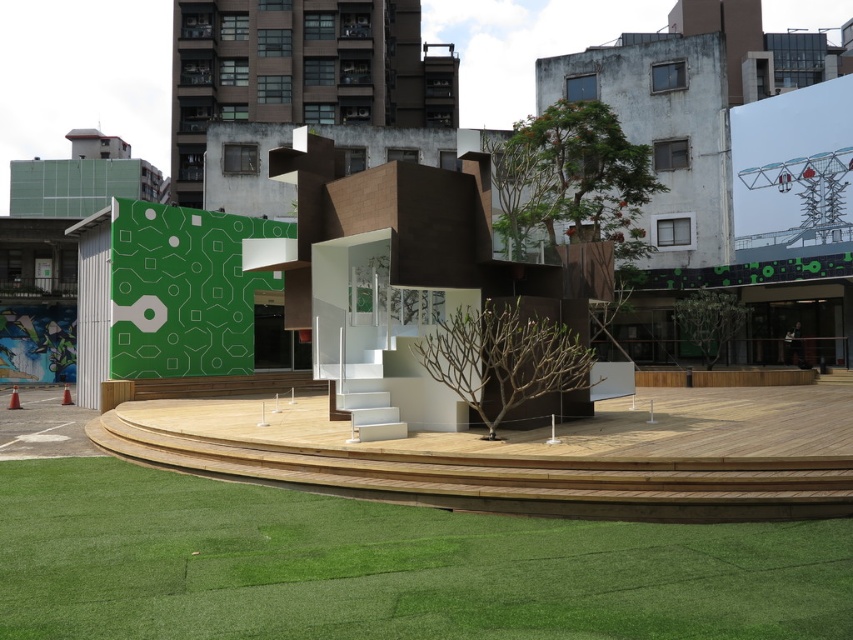
You are a visitor standing at the base of the installation and want to take a photo of the green artificial turf at lower center without the green matte wall at upper left appearing in the frame. Is this possible given their positions?

The green artificial turf at lower center is below the green matte wall at upper left, so if you position yourself lower and angle the camera downward, you can capture the green artificial turf at lower center without including the green matte wall at upper left in the shot.

You are a landscape architect designing a new park. You have to decide whether to place a new sculpture that requires a minimum height clearance of 2 meters between the green artificial turf at lower center and the green matte wall at upper left. Can the space accommodate this requirement?

The green artificial turf at lower center is not as tall as the green matte wall at upper left, but the exact height difference isn not specified. Without knowing the actual heights, it is impossible to determine if the 2 meter clearance is met.

You are a visitor standing at the entrance of the installation. You want to take a photo of the green artificial turf at lower center without the green matte wall at upper left appearing in the background. Is this possible based on their positions?

The green artificial turf at lower center is in front of the green matte wall at upper left, so the wall will be behind the turf. To avoid the wall in the photo, you would need to position yourself so the turf blocks the view of the wall, but since the turf is closer to you than the wall, you can frame the shot so only the turf is visible without the wall in the background.